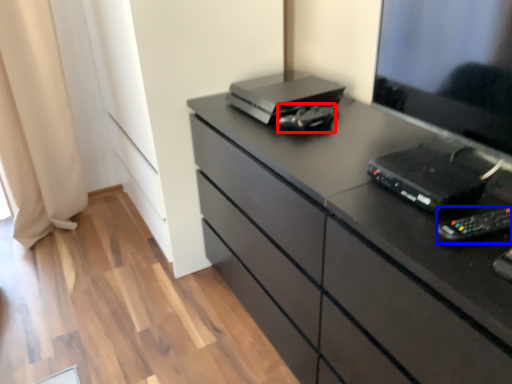
Question: Among these objects, which one is nearest to the camera, equipment (highlighted by a red box) or equipment (highlighted by a blue box)?

Choices:
 (A) equipment
 (B) equipment

Answer: (B)